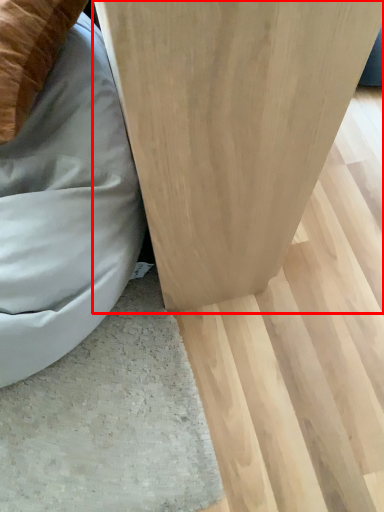
Question: From the image's perspective, where is furniture (annotated by the red box) located relative to bean bag chair?

Choices:
 (A) above
 (B) below

Answer: (A)